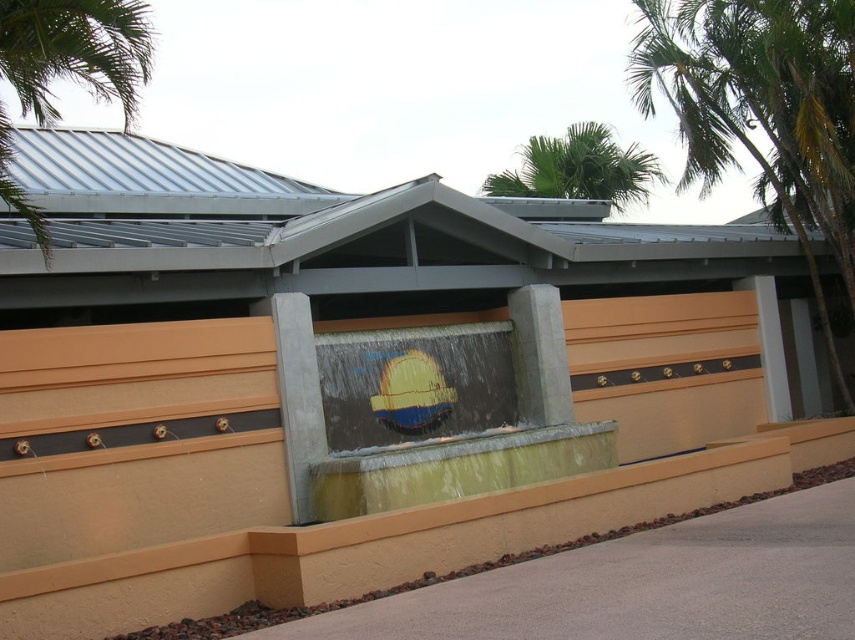
You are standing in front of the modern architectural structure described. There is a specific point marked at coordinates point (547, 161). If you want to reach this point by walking straight ahead, how far will you have to walk?

The point (547, 161) is 27.79 meters away from the viewer, so you will have to walk 27.79 meters straight ahead to reach it.